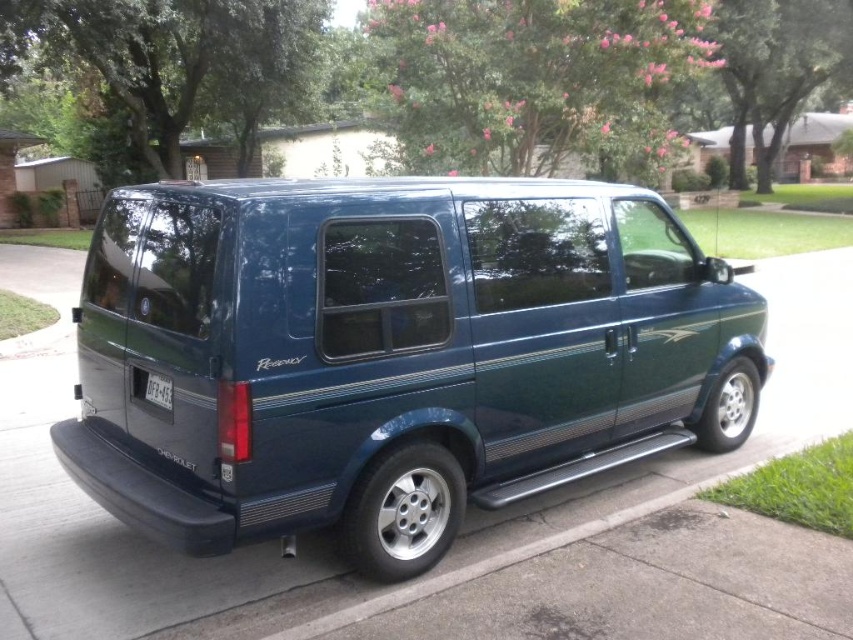
You are a delivery person who needs to park your van in a parking spot that is exactly the same width as the white plastic license plate at lower center. Can you fit the metallic blue van at center into this parking spot?

The metallic blue van at center is wider than the white plastic license plate at lower center, so it cannot fit into a parking spot that is exactly the same width as the license plate.

You are a delivery driver who needs to park your van in a tight space. You see the metallic blue van at center and the white plastic license plate at lower center. Which object is closer to the right side of the parking spot?

The metallic blue van at center is positioned on the right side of the white plastic license plate at lower center, so the metallic blue van at center is closer to the right side of the parking spot.

You are a delivery driver who needs to park your metallic blue van at center so that its license plate is fully visible. Based on the current positioning, will the white plastic license plate at lower center be covered by the van?

→ The metallic blue van at center is positioned over white plastic license plate at lower center, so yes, the license plate will be covered and not fully visible.